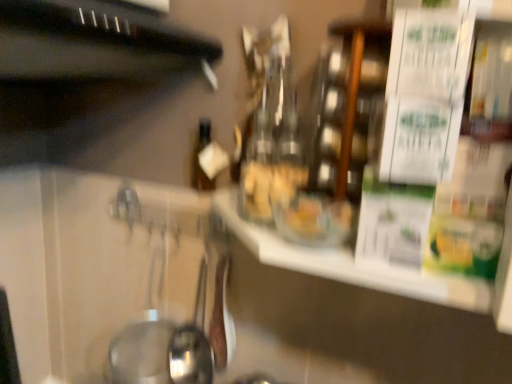
Question: Should I look upward or downward to see shiny silver spoon at center?

Choices:
 (A) up
 (B) down

Answer: (B)